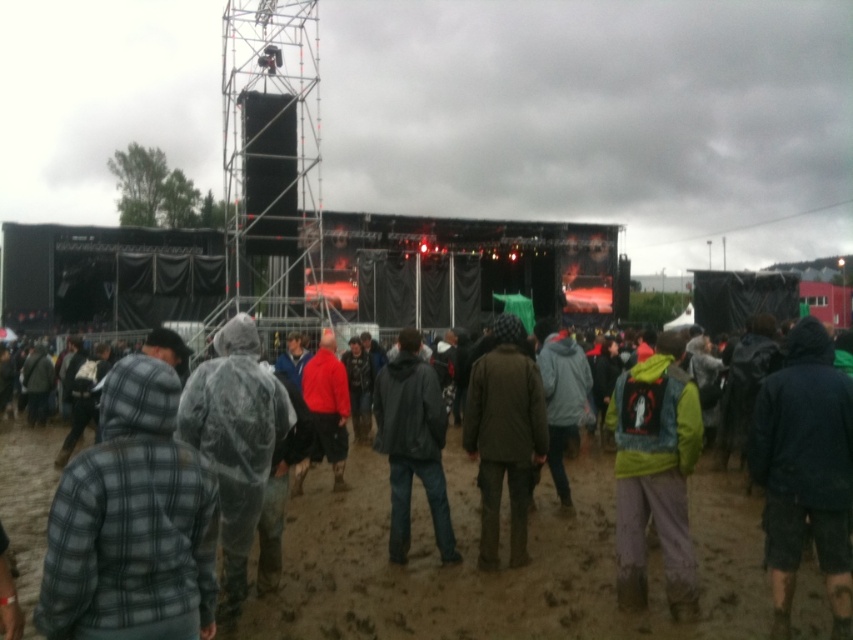
You are a photographer at the concert and want to capture both the plaid wool jacket at lower left and the green matte jacket at center in a single frame. Given their sizes, which jacket will occupy more space in the photo?

The plaid wool jacket at lower left will occupy more space in the photo because its width is larger than the green matte jacket at center.

You are a stage manager at the outdoor concert. You need to place a 5 meter long banner between the plaid wool jacket at lower left and the green matte jacket at center. Will the banner fit between them without overlapping either jacket?

The plaid wool jacket at lower left and green matte jacket at center are 6.36 meters apart. Since the banner is 5 meters long, it will fit between them with 1.36 meters of space remaining on either side, so yes, it can be placed without overlapping.

You are a photographer at the concert and want to capture a photo of the dark blue jacket at center without the plaid fabric jacket at center blocking it. What should you do?

The plaid fabric jacket at center is in front of the dark blue jacket at center. To capture the dark blue jacket at center without obstruction, you should move your position to the side so that the plaid fabric jacket at center is no longer between you and the dark blue jacket at center.